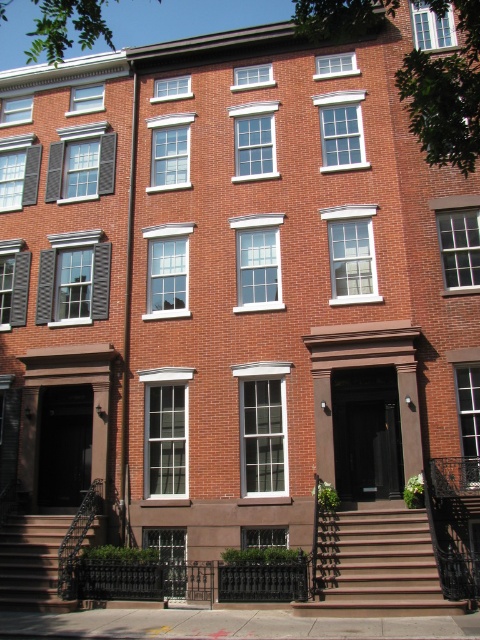
The width and height of the screenshot is (480, 640). I want to click on brown wooden stairs at center, so click(376, 564).

Between brown wooden stairs at center and brown wooden stairs at lower left, which one is positioned lower?

brown wooden stairs at lower left is lower down.

Between point (370, 608) and point (19, 538), which one is positioned in front?

Point (370, 608) is more forward.

Identify the location of brown wooden stairs at center. (376, 564).